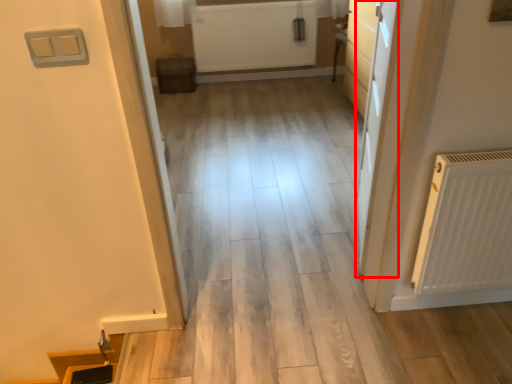
Question: From the image's perspective, where is door (annotated by the red box) located relative to radiator?

Choices:
 (A) above
 (B) below

Answer: (B)